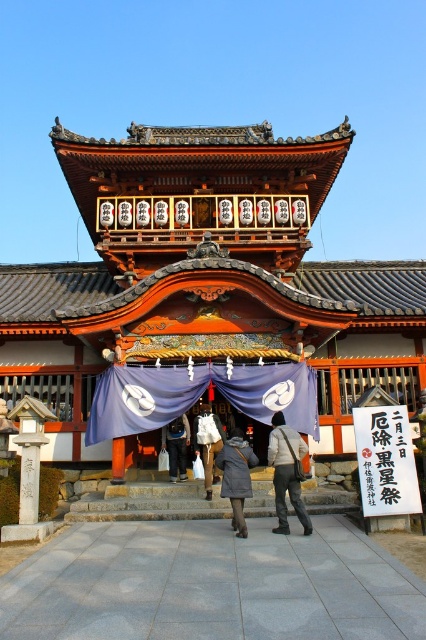
You are a visitor at the shrine and see both the white paper sign at center and the dark gray wool coat at center. Which object is located to the right when facing the shrine entrance?

The white paper sign at center is positioned on the right side of dark gray wool coat at center, so the white paper sign at center is located to the right when facing the shrine entrance.

You are visiting the shrine and see the white cotton bag at center and the dark gray fabric bag at center. Which bag is placed on top of the other?

The white cotton bag at center is positioned over the dark gray fabric bag at center, so it is placed on top.